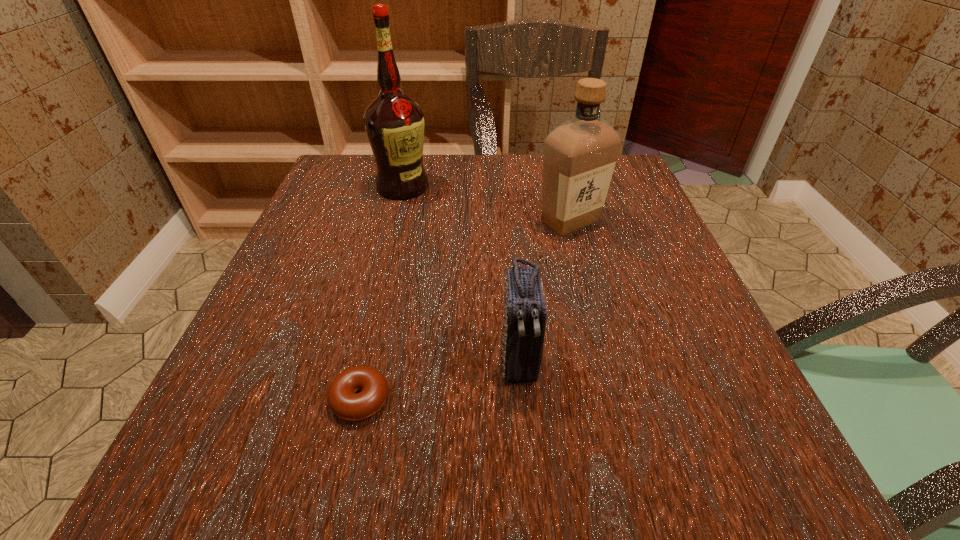
Where is `vacant region located 0.050m on the back of the doughnut`? This screenshot has height=540, width=960. vacant region located 0.050m on the back of the doughnut is located at coordinates (372, 348).

Find the location of a particular element. The width and height of the screenshot is (960, 540). alcohol present at the far edge is located at coordinates (394, 123).

What are the coordinates of `liquor located in the far edge section of the desktop` in the screenshot? It's located at (x=579, y=156).

Where is `object that is at the left edge`? This screenshot has height=540, width=960. object that is at the left edge is located at coordinates (394, 123).

The height and width of the screenshot is (540, 960). Identify the location of object situated at the right edge. (579, 156).

Identify the location of object that is positioned at the far left corner. This screenshot has height=540, width=960. (394, 123).

Find the location of `object that is at the far right corner`. object that is at the far right corner is located at coordinates (579, 156).

Where is `vacant space at the far edge of the desktop`? vacant space at the far edge of the desktop is located at coordinates [445, 179].

The height and width of the screenshot is (540, 960). Find the location of `vacant space at the near edge of the desktop`. vacant space at the near edge of the desktop is located at coordinates (546, 487).

Where is `vacant region at the left edge`? vacant region at the left edge is located at coordinates click(x=284, y=284).